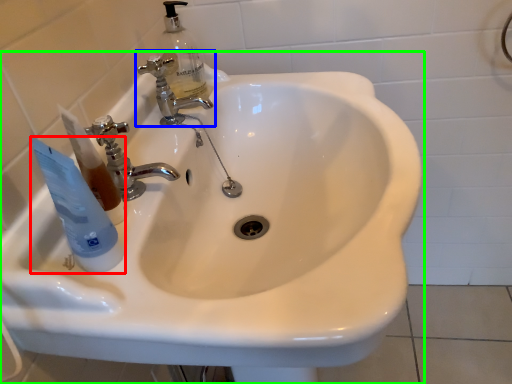
Question: Considering the real-world distances, which object is farthest from mouthwash (highlighted by a red box)? tap (highlighted by a blue box) or sink (highlighted by a green box)?

Choices:
 (A) tap
 (B) sink

Answer: (A)